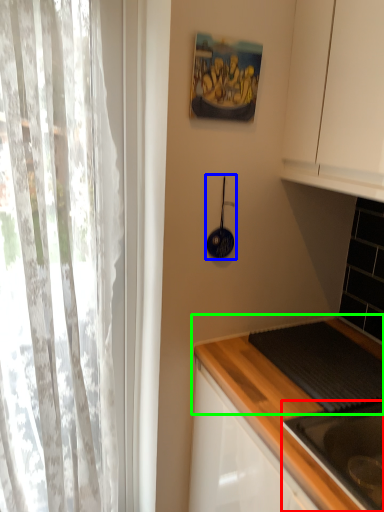
Question: Which is farther away from sink (highlighted by a red box)? appliance (highlighted by a blue box) or countertop (highlighted by a green box)?

Choices:
 (A) appliance
 (B) countertop

Answer: (A)